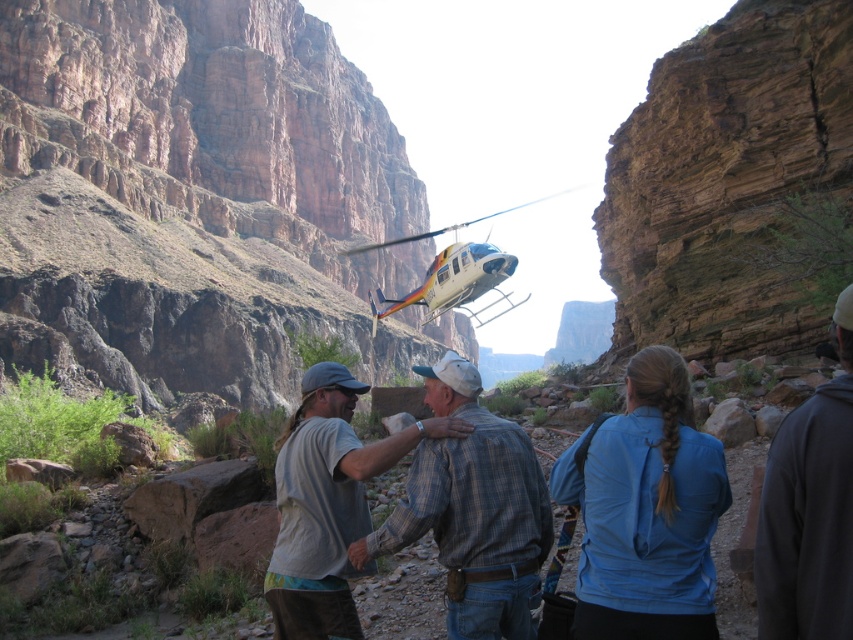
Does light gray cotton shirt at center have a larger size compared to dark gray hoodie at lower right?

Correct, light gray cotton shirt at center is larger in size than dark gray hoodie at lower right.

In the scene shown: Is light gray cotton shirt at center thinner than dark gray hoodie at lower right?

No.

Is point (311, 620) positioned before point (834, 528)?

No, it is not.

The image size is (853, 640). What are the coordinates of `light gray cotton shirt at center` in the screenshot? It's located at (328, 502).

Can you confirm if plaid fabric shirt at center is positioned above dark gray hoodie at lower right?

Actually, plaid fabric shirt at center is below dark gray hoodie at lower right.

Does plaid fabric shirt at center appear on the right side of dark gray hoodie at lower right?

No, plaid fabric shirt at center is not to the right of dark gray hoodie at lower right.

This screenshot has width=853, height=640. Identify the location of plaid fabric shirt at center. [473, 512].

This screenshot has height=640, width=853. I want to click on plaid fabric shirt at center, so click(x=473, y=512).

Can you confirm if light gray cotton shirt at center is bigger than white plastic helicopter at center?

Incorrect, light gray cotton shirt at center is not larger than white plastic helicopter at center.

Where is `light gray cotton shirt at center`? This screenshot has width=853, height=640. light gray cotton shirt at center is located at coordinates (328, 502).